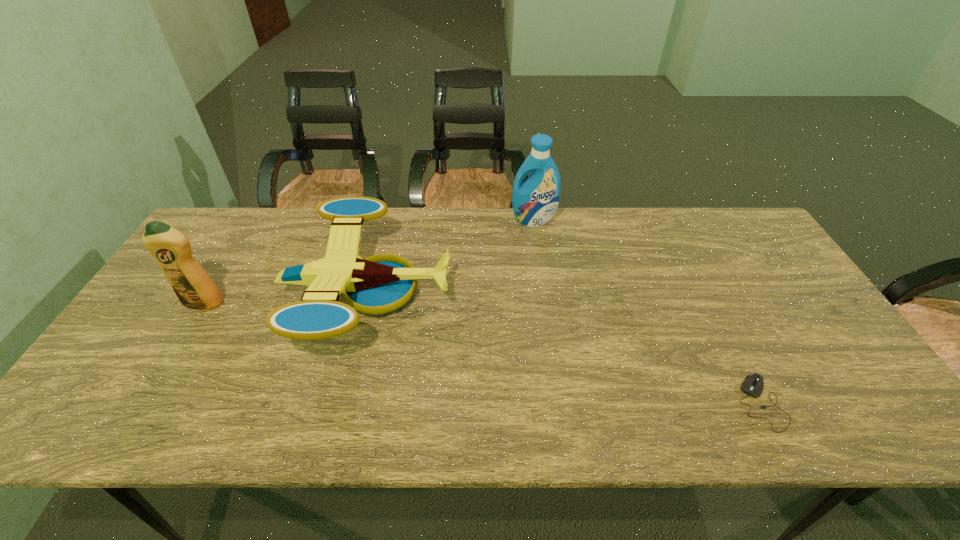
Locate an element on the screen. vacant region at the far left corner is located at coordinates (222, 244).

In the image, there is a desktop. Where is `vacant space at the far right corner`? Image resolution: width=960 pixels, height=540 pixels. vacant space at the far right corner is located at coordinates (724, 213).

This screenshot has height=540, width=960. I want to click on free space between the third object from left to right and the nearest object, so click(x=647, y=311).

Locate an element on the screen. vacant space that's between the left detergent and the shortest object is located at coordinates (482, 353).

Locate an element on the screen. free area in between the second object from left to right and the right detergent is located at coordinates (450, 256).

Where is `free space that is in between the leftmost object and the nearest object`? This screenshot has height=540, width=960. free space that is in between the leftmost object and the nearest object is located at coordinates (482, 353).

What are the coordinates of `empty space between the drone and the farthest object` in the screenshot? It's located at (450, 256).

The width and height of the screenshot is (960, 540). What are the coordinates of `free space that is in between the third tallest object and the leftmost object` in the screenshot? It's located at (286, 299).

What are the coordinates of `free space between the computer mouse and the leftmost object` in the screenshot? It's located at (482, 353).

The height and width of the screenshot is (540, 960). In order to click on vacant space in between the computer mouse and the leftmost object in this screenshot , I will do `click(482, 353)`.